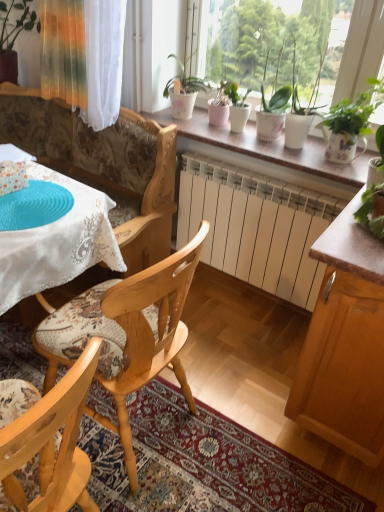
Where is `free space to the left of matte brown cabinet at right`? The height and width of the screenshot is (512, 384). free space to the left of matte brown cabinet at right is located at coordinates (241, 366).